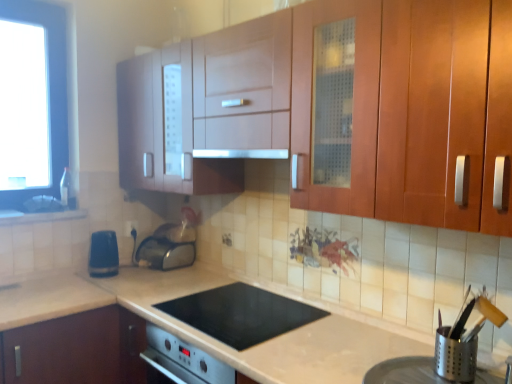
Identify the location of free spot above black glass cooktop at center (from a real-world perspective). This screenshot has width=512, height=384. (237, 306).